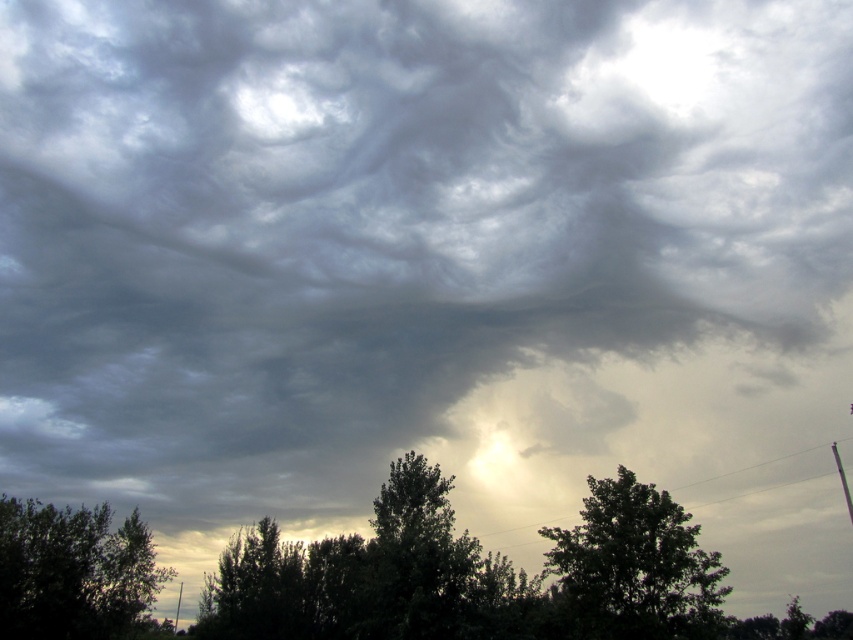
Question: Estimate the real-world distances between objects in this image. Which object is farther from the dark green leafy tree at lower left?

Choices:
 (A) green leafy tree at upper center
 (B) dark green leafy tree at center

Answer: (A)

Question: Can you confirm if green leafy tree at upper center is thinner than dark green leafy tree at center?

Choices:
 (A) yes
 (B) no

Answer: (B)

Question: Which point is farther to the camera?

Choices:
 (A) green leafy tree at upper center
 (B) dark green leafy tree at lower left

Answer: (B)

Question: Which object appears closest to the camera in this image?

Choices:
 (A) dark green leafy tree at lower left
 (B) dark green leafy tree at center
 (C) green leafy tree at upper center

Answer: (C)

Question: Is green leafy tree at upper center wider than dark green leafy tree at lower left?

Choices:
 (A) yes
 (B) no

Answer: (B)

Question: Is green leafy tree at upper center wider than dark green leafy tree at center?

Choices:
 (A) no
 (B) yes

Answer: (B)